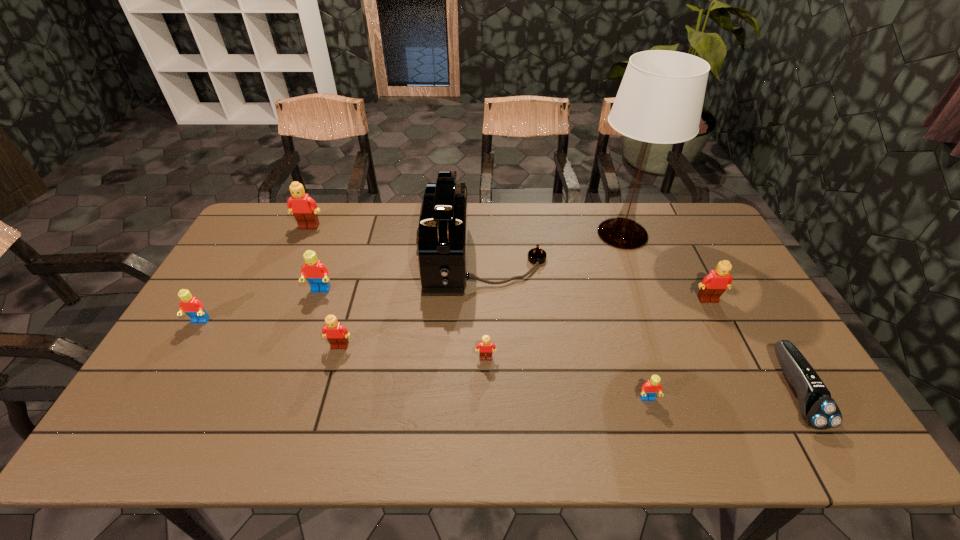
Where is `free region at the far right corner`? Image resolution: width=960 pixels, height=540 pixels. free region at the far right corner is located at coordinates (672, 217).

At what (x,y) coordinates should I click in order to perform the action: click on empty space that is in between the table lamp and the second red Lego from right to left. Please return your answer as a coordinate pair (x, y). Looking at the image, I should click on (471, 262).

This screenshot has height=540, width=960. What are the coordinates of `unoccupied area between the second red Lego from right to left and the electric shaver` in the screenshot? It's located at (558, 341).

You are a GUI agent. You are given a task and a screenshot of the screen. Output one action in this format:
    pyautogui.click(x=<x>, y=<y>)
    Task: Click on the vacant space that is in between the leftmost red Lego and the table lamp
    
    Given the screenshot: What is the action you would take?
    pyautogui.click(x=411, y=278)

Find the location of a particular element. Image resolution: width=960 pixels, height=540 pixels. vacant area between the table lamp and the nearest red Lego is located at coordinates (635, 316).

You are a GUI agent. You are given a task and a screenshot of the screen. Output one action in this format:
    pyautogui.click(x=<x>, y=<y>)
    Task: Click on the vacant space in between the ninth shortest object and the farthest brown Lego
    The image size is (960, 540).
    Given the screenshot: What is the action you would take?
    pyautogui.click(x=397, y=244)

Locate an element on the screen. The height and width of the screenshot is (540, 960). free space between the biggest brown Lego and the radio receiver is located at coordinates (397, 244).

Where is `vacant space that is in between the rightmost object and the nearest Lego`? The width and height of the screenshot is (960, 540). vacant space that is in between the rightmost object and the nearest Lego is located at coordinates (721, 395).

At what (x,y) coordinates should I click in order to perform the action: click on vacant area that lies between the smallest red Lego and the tallest object. Please return your answer as a coordinate pair (x, y). The width and height of the screenshot is (960, 540). Looking at the image, I should click on (635, 316).

The height and width of the screenshot is (540, 960). Find the location of `unoccupied area between the nearest brown Lego and the farthest red Lego`. unoccupied area between the nearest brown Lego and the farthest red Lego is located at coordinates (403, 325).